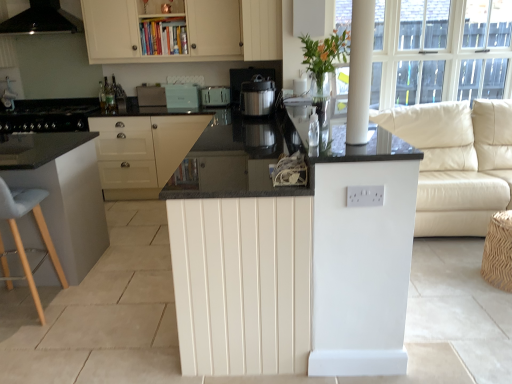
Question: Should I look upward or downward to see light blue fabric stool at left, which is the first bar stool in left-to-right order?

Choices:
 (A) down
 (B) up

Answer: (A)

Question: Can you confirm if light blue fabric stool at left, which is counted as the second bar stool, starting from the right, is bigger than white plastic toaster at upper center, the third appliance positioned from the right?

Choices:
 (A) no
 (B) yes

Answer: (B)

Question: From the image's perspective, is light blue fabric stool at left, which is counted as the second bar stool, starting from the right, on top of white plastic toaster at upper center, the third appliance positioned from the right?

Choices:
 (A) yes
 (B) no

Answer: (B)

Question: Could you tell me if light blue fabric stool at left, which is counted as the second bar stool, starting from the right, is facing white plastic toaster at upper center, which ranks as the second appliance in left-to-right order?

Choices:
 (A) no
 (B) yes

Answer: (B)

Question: Does light blue fabric stool at left, which is the first bar stool in left-to-right order, have a smaller size compared to white plastic toaster at upper center, the third appliance positioned from the right?

Choices:
 (A) no
 (B) yes

Answer: (A)

Question: Does light blue fabric stool at left, which is counted as the second bar stool, starting from the right, have a greater width compared to white plastic toaster at upper center, which ranks as the second appliance in left-to-right order?

Choices:
 (A) yes
 (B) no

Answer: (A)

Question: Does light blue fabric stool at left, which is the first bar stool in left-to-right order, have a lesser height compared to white plastic toaster at upper center, which ranks as the second appliance in left-to-right order?

Choices:
 (A) no
 (B) yes

Answer: (A)

Question: Is white glossy counter at center smaller than white glossy pillar at upper right?

Choices:
 (A) yes
 (B) no

Answer: (B)

Question: From a real-world perspective, is white glossy counter at center on white glossy pillar at upper right?

Choices:
 (A) yes
 (B) no

Answer: (B)

Question: Is white glossy counter at center surrounding white glossy pillar at upper right?

Choices:
 (A) yes
 (B) no

Answer: (B)

Question: Is white glossy counter at center further to camera compared to white glossy pillar at upper right?

Choices:
 (A) yes
 (B) no

Answer: (A)

Question: Is white glossy counter at center far from white glossy pillar at upper right?

Choices:
 (A) yes
 (B) no

Answer: (B)

Question: From a real-world perspective, is white glossy counter at center beneath white glossy pillar at upper right?

Choices:
 (A) no
 (B) yes

Answer: (B)

Question: Is light blue fabric stool at left, which is counted as the second bar stool, starting from the right, wider than black matte range hood at upper left?

Choices:
 (A) yes
 (B) no

Answer: (B)